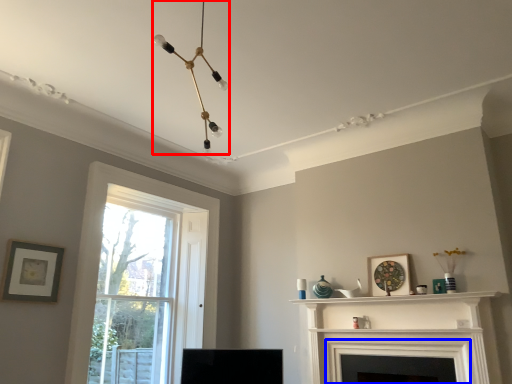
Question: Among these objects, which one is nearest to the camera, light fixture (highlighted by a red box) or fireplace (highlighted by a blue box)?

Choices:
 (A) light fixture
 (B) fireplace

Answer: (A)